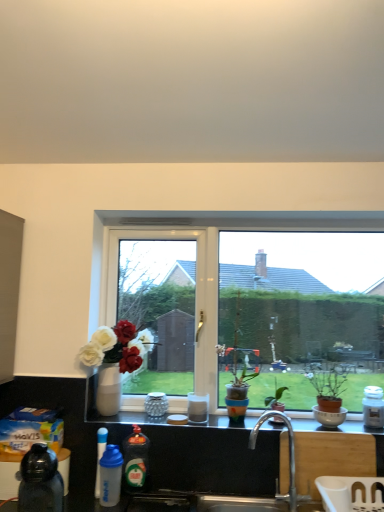
You are a GUI agent. You are given a task and a screenshot of the screen. Output one action in this format:
    pyautogui.click(x=<x>, y=<y>)
    Task: Click on the vacant region above white glossy window at center (from a real-world perspective)
    
    Given the screenshot: What is the action you would take?
    pyautogui.click(x=240, y=227)